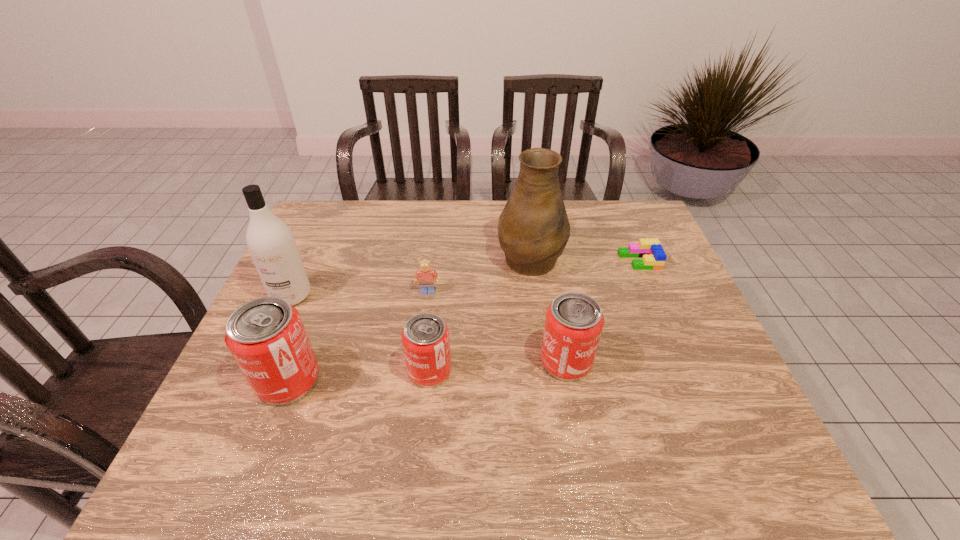
Where is `empty space between the taller Lego and the right Lego`? The image size is (960, 540). empty space between the taller Lego and the right Lego is located at coordinates (534, 276).

Locate an element on the screen. This screenshot has width=960, height=540. unoccupied area between the left Lego and the rightmost can is located at coordinates coord(497,326).

Where is `free space between the rightmost can and the shortest can`? free space between the rightmost can and the shortest can is located at coordinates (498, 366).

Where is `free space that is in between the leftmost can and the pitcher`? free space that is in between the leftmost can and the pitcher is located at coordinates (409, 318).

Find the location of a particular element. Image resolution: width=960 pixels, height=540 pixels. free space between the left Lego and the pitcher is located at coordinates (479, 274).

Locate an element on the screen. Image resolution: width=960 pixels, height=540 pixels. free spot between the shampoo and the pitcher is located at coordinates (411, 276).

Locate an element on the screen. The width and height of the screenshot is (960, 540). free space between the second shortest object and the fourth tallest object is located at coordinates (497, 326).

Where is `object that is the fifth closest to the second shortest can`? The width and height of the screenshot is (960, 540). object that is the fifth closest to the second shortest can is located at coordinates (266, 336).

The height and width of the screenshot is (540, 960). Identify the location of object that ranks as the third closest to the leftmost can. (426, 275).

This screenshot has height=540, width=960. In order to click on can that is the second closest to the shorter Lego in this screenshot , I will do `click(425, 337)`.